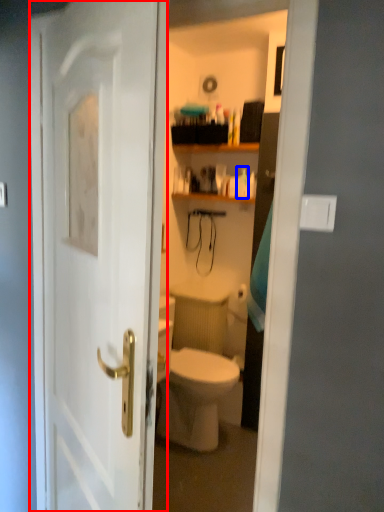
Question: Which of the following is the closest to the observer, door (highlighted by a red box) or toiletry (highlighted by a blue box)?

Choices:
 (A) door
 (B) toiletry

Answer: (A)